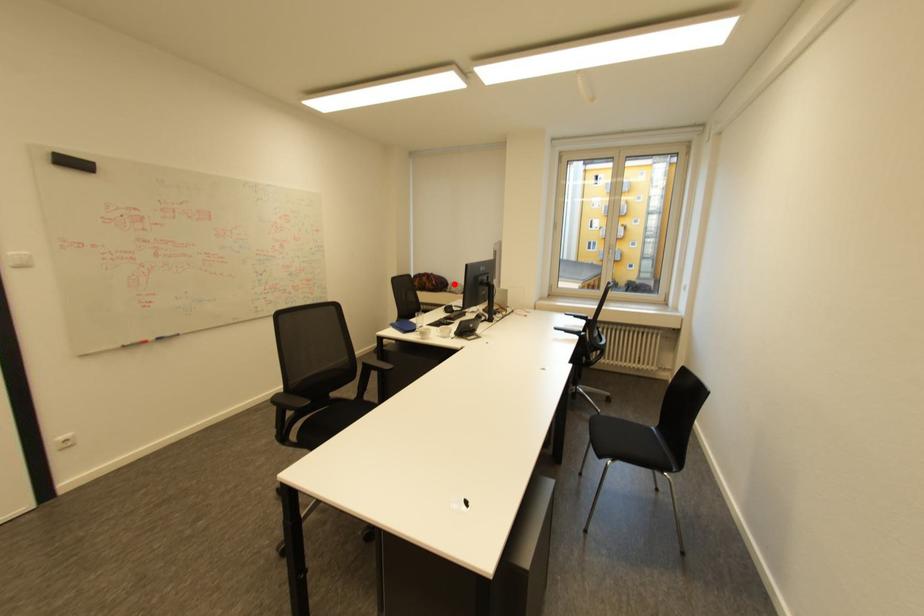
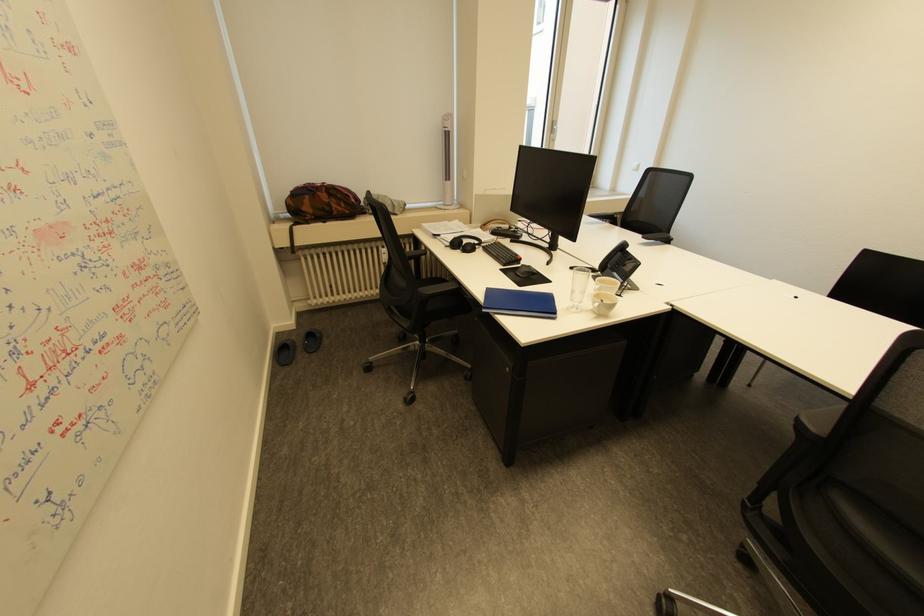
Find the pixel in the second image that matches the highlighted location in the first image.

(367, 200)